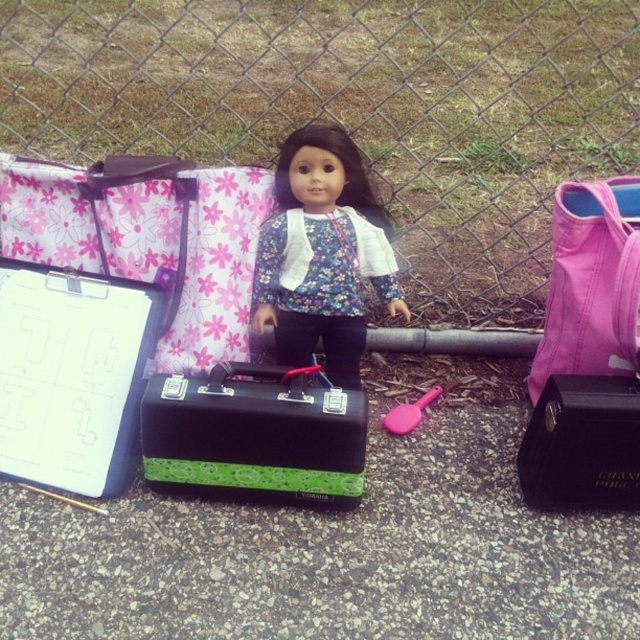
Where is the pink fabric backpack at right located in the image?

The pink fabric backpack at right is located at point (592, 284).

You are a delivery person who needs to place a small package on the green textured case at center. Can you confirm the exact location coordinates where you should place the package?

The green textured case at center is located at coordinates point (253, 433), so place the package there.